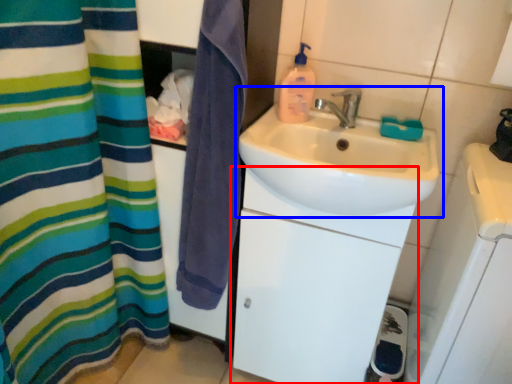
Question: Which point is closer to the camera, bathroom cabinet (highlighted by a red box) or sink (highlighted by a blue box)?

Choices:
 (A) bathroom cabinet
 (B) sink

Answer: (B)